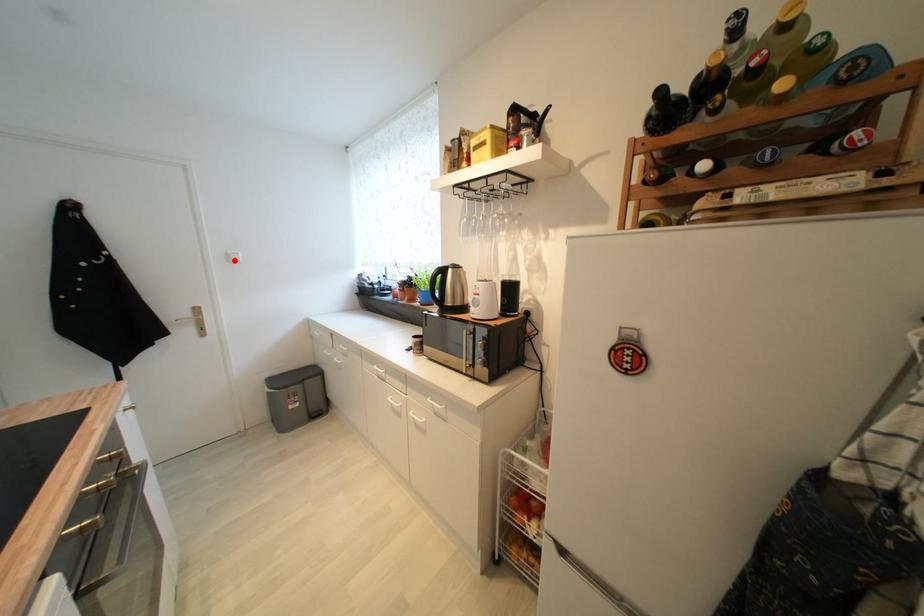
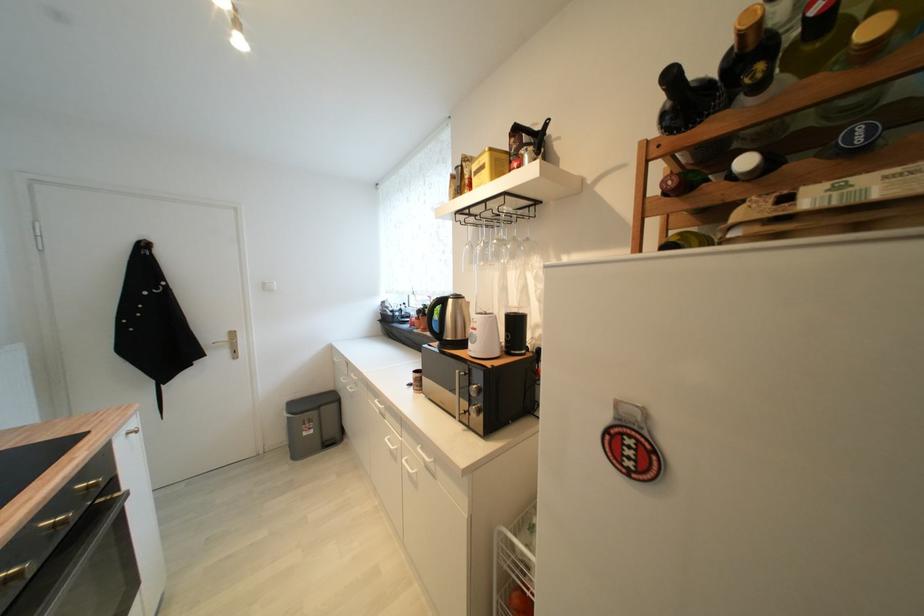
Locate, in the second image, the point that corresponds to the highlighted location in the first image.

(271, 289)